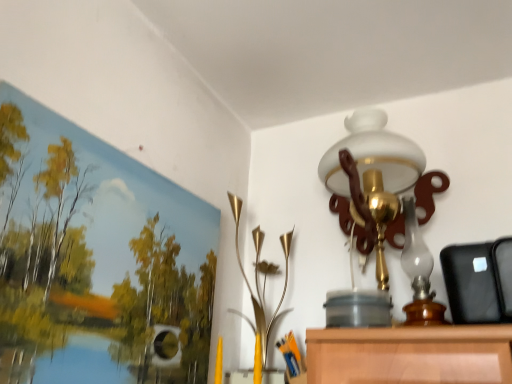
Where is `white glass lamp at upper center, positioned as the second lamp in left-to-right order`? white glass lamp at upper center, positioned as the second lamp in left-to-right order is located at coordinates (380, 216).

This screenshot has width=512, height=384. I want to click on matte canvas landscape at upper left, so click(x=97, y=259).

Considering the positions of objects gold metallic vase at center, the second lamp viewed from the right, and white glass lamp at upper center, the first lamp from the right, in the image provided, who is more to the left, gold metallic vase at center, the second lamp viewed from the right, or white glass lamp at upper center, the first lamp from the right,?

From the viewer's perspective, gold metallic vase at center, the second lamp viewed from the right, appears more on the left side.

Considering the points (232, 211) and (406, 312), which point is behind, point (232, 211) or point (406, 312)?

The point (232, 211) is more distant.

From the picture: Is gold metallic vase at center, which is the first lamp from left to right, bigger or smaller than white glass lamp at upper center, the first lamp from the right?

gold metallic vase at center, which is the first lamp from left to right, is smaller than white glass lamp at upper center, the first lamp from the right.

Are gold metallic vase at center, which is the first lamp from left to right, and white glass lamp at upper center, the first lamp from the right, far apart?

They are positioned close to each other.

Is gold metallic vase at center, the second lamp viewed from the right, shorter than matte canvas landscape at upper left?

Incorrect, the height of gold metallic vase at center, the second lamp viewed from the right, does not fall short of that of matte canvas landscape at upper left.

Does gold metallic vase at center, which is the first lamp from left to right, come behind matte canvas landscape at upper left?

Yes, gold metallic vase at center, which is the first lamp from left to right, is behind matte canvas landscape at upper left.

From the image's perspective, relative to matte canvas landscape at upper left, is gold metallic vase at center, which is the first lamp from left to right, above or below?

Clearly, from the image's perspective, gold metallic vase at center, which is the first lamp from left to right, is below matte canvas landscape at upper left.

Between gold metallic vase at center, the second lamp viewed from the right, and matte canvas landscape at upper left, which one has smaller width?

matte canvas landscape at upper left.

Would you say white glass lamp at upper center, the first lamp from the right, is inside or outside gold metallic vase at center, which is the first lamp from left to right?

white glass lamp at upper center, the first lamp from the right, is outside gold metallic vase at center, which is the first lamp from left to right.

This screenshot has width=512, height=384. Identify the location of lamp that appears below the white glass lamp at upper center, positioned as the second lamp in left-to-right order (from the image's perspective). (256, 279).

Is matte canvas landscape at upper left taller or shorter than white glass lamp at upper center, the first lamp from the right?

Clearly, matte canvas landscape at upper left is shorter compared to white glass lamp at upper center, the first lamp from the right.

How much distance is there between matte canvas landscape at upper left and white glass lamp at upper center, the first lamp from the right?

matte canvas landscape at upper left is 18.72 inches from white glass lamp at upper center, the first lamp from the right.

Is matte canvas landscape at upper left behind white glass lamp at upper center, positioned as the second lamp in left-to-right order?

That is False.

Is matte canvas landscape at upper left not within white glass lamp at upper center, positioned as the second lamp in left-to-right order?

Yes, matte canvas landscape at upper left is not within white glass lamp at upper center, positioned as the second lamp in left-to-right order.

Is matte canvas landscape at upper left inside or outside of gold metallic vase at center, which is the first lamp from left to right?

matte canvas landscape at upper left is outside gold metallic vase at center, which is the first lamp from left to right.

Between matte canvas landscape at upper left and gold metallic vase at center, which is the first lamp from left to right, which one has larger size?

Bigger between the two is gold metallic vase at center, which is the first lamp from left to right.

What's the angular difference between matte canvas landscape at upper left and gold metallic vase at center, the second lamp viewed from the right,'s facing directions?

There is a 89.1-degree angle between the facing directions of matte canvas landscape at upper left and gold metallic vase at center, the second lamp viewed from the right.

Based on the photo, which of these two, matte canvas landscape at upper left or gold metallic vase at center, the second lamp viewed from the right, is wider?

gold metallic vase at center, the second lamp viewed from the right, is wider.

Is white glass lamp at upper center, the first lamp from the right, beside matte canvas landscape at upper left?

No.

Considering the sizes of objects white glass lamp at upper center, positioned as the second lamp in left-to-right order, and matte canvas landscape at upper left in the image provided, who is bigger, white glass lamp at upper center, positioned as the second lamp in left-to-right order, or matte canvas landscape at upper left?

white glass lamp at upper center, positioned as the second lamp in left-to-right order.

Is point (328, 293) positioned in front of point (196, 248)?

No, it is behind (196, 248).

Based on the photo, between white glass lamp at upper center, positioned as the second lamp in left-to-right order, and matte canvas landscape at upper left, which one has more height?

With more height is white glass lamp at upper center, positioned as the second lamp in left-to-right order.

The height and width of the screenshot is (384, 512). Identify the location of lamp in front of the gold metallic vase at center, the second lamp viewed from the right. (380, 216).

Where is `oil painting beneath the gold metallic vase at center, which is the first lamp from left to right (from a real-world perspective)`? The width and height of the screenshot is (512, 384). oil painting beneath the gold metallic vase at center, which is the first lamp from left to right (from a real-world perspective) is located at coordinates (97, 259).

From the image, which object appears to be farther from matte canvas landscape at upper left, white glass lamp at upper center, positioned as the second lamp in left-to-right order, or gold metallic vase at center, the second lamp viewed from the right?

white glass lamp at upper center, positioned as the second lamp in left-to-right order, is positioned further to the anchor matte canvas landscape at upper left.

When comparing their distances from white glass lamp at upper center, positioned as the second lamp in left-to-right order, does matte canvas landscape at upper left or gold metallic vase at center, the second lamp viewed from the right, seem closer?

gold metallic vase at center, the second lamp viewed from the right, is positioned closer to the anchor white glass lamp at upper center, positioned as the second lamp in left-to-right order.

Consider the image. Looking at the image, which one is located closer to matte canvas landscape at upper left, gold metallic vase at center, the second lamp viewed from the right, or white glass lamp at upper center, the first lamp from the right?

gold metallic vase at center, the second lamp viewed from the right, lies closer to matte canvas landscape at upper left than the other object.

Which object lies nearer to the anchor point gold metallic vase at center, the second lamp viewed from the right, matte canvas landscape at upper left or white glass lamp at upper center, the first lamp from the right?

The object closer to gold metallic vase at center, the second lamp viewed from the right, is white glass lamp at upper center, the first lamp from the right.

Which object lies further to the anchor point white glass lamp at upper center, positioned as the second lamp in left-to-right order, gold metallic vase at center, the second lamp viewed from the right, or matte canvas landscape at upper left?

Based on the image, matte canvas landscape at upper left appears to be further to white glass lamp at upper center, positioned as the second lamp in left-to-right order.

Based on their spatial positions, is white glass lamp at upper center, the first lamp from the right, or matte canvas landscape at upper left further from gold metallic vase at center, the second lamp viewed from the right?

matte canvas landscape at upper left is further to gold metallic vase at center, the second lamp viewed from the right.

You are a GUI agent. You are given a task and a screenshot of the screen. Output one action in this format:
    pyautogui.click(x=<x>, y=<y>)
    Task: Click on the lamp situated between matte canvas landscape at upper left and white glass lamp at upper center, positioned as the second lamp in left-to-right order, from left to right
    This screenshot has width=512, height=384.
    Given the screenshot: What is the action you would take?
    pyautogui.click(x=256, y=279)